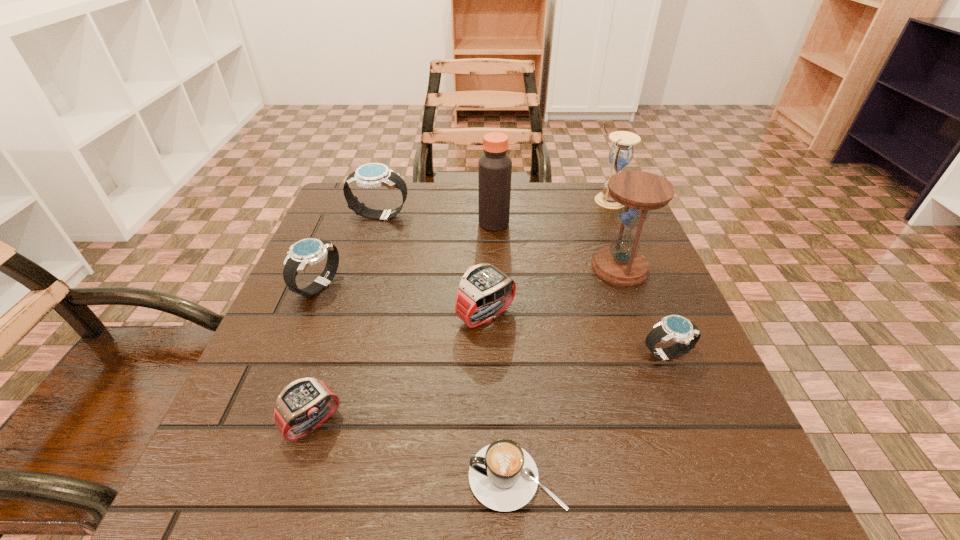
I want to click on free space located on the back of the third nearest object, so click(x=639, y=287).

Image resolution: width=960 pixels, height=540 pixels. I want to click on free space located 0.060m on the back of the smaller red watch, so click(x=329, y=370).

Identify the location of vacant region located with the handle on the side of the shortest object. (318, 477).

Locate an element on the screen. This screenshot has width=960, height=540. vacant space located 0.170m with the handle on the side of the shortest object is located at coordinates (347, 477).

Where is `vacant region located with the handle on the side of the shortest object`? vacant region located with the handle on the side of the shortest object is located at coordinates (289, 477).

What are the coordinates of `vinegar that is at the far edge` in the screenshot? It's located at (494, 167).

At what (x,y) coordinates should I click in order to perform the action: click on hourglass situated at the far edge. Please return your answer as a coordinate pair (x, y). The width and height of the screenshot is (960, 540). Looking at the image, I should click on (621, 153).

You are a GUI agent. You are given a task and a screenshot of the screen. Output one action in this format:
    pyautogui.click(x=<x>, y=<y>)
    Task: Click on the watch that is positioned at the far edge
    
    Given the screenshot: What is the action you would take?
    pyautogui.click(x=373, y=175)

Where is `object present at the near edge`? This screenshot has height=540, width=960. object present at the near edge is located at coordinates (503, 476).

Where is `watch at the right edge`? The width and height of the screenshot is (960, 540). watch at the right edge is located at coordinates (673, 327).